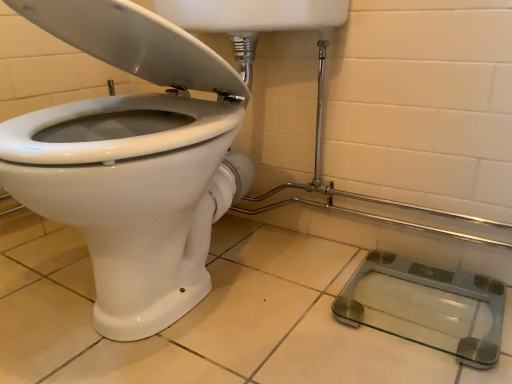
Question: Should I look upward or downward to see transparent glass scale at lower right?

Choices:
 (A) down
 (B) up

Answer: (A)